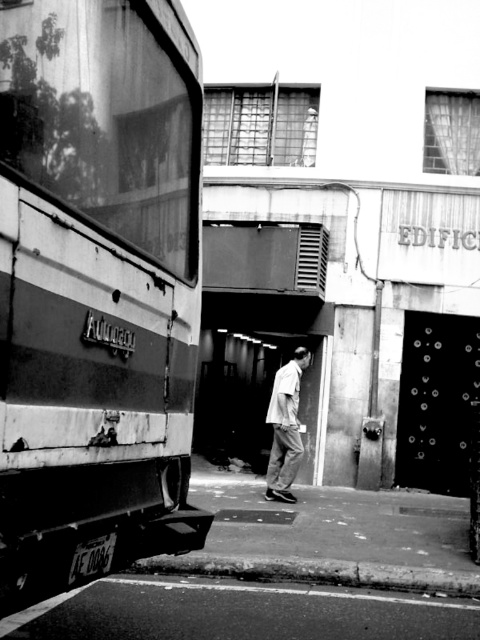
You are a photographer standing in the scene. You want to take a photo of the smooth asphalt train track at lower left and the light gray cotton shirt at center. Which object should you zoom in on to make them appear the same size in the photo?

The smooth asphalt train track at lower left is larger in size than light gray cotton shirt at center. To make them appear the same size in the photo, you should zoom in on the light gray cotton shirt at center.

You are a delivery person needing to move a package from the rusty metal train car at left to the smooth asphalt train track at lower left. Can you carry the package directly between them without needing to go around?

The rusty metal train car at left and the smooth asphalt train track at lower left are 3.47 feet apart, so yes, you can carry the package directly between them since the distance is sufficient for a person to move through without needing to detour.